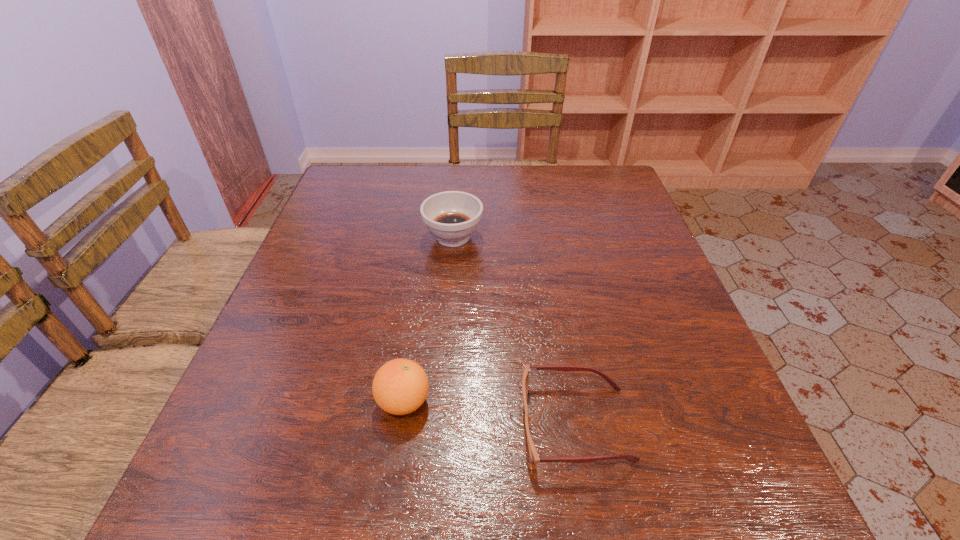
Find the location of `unoccupied position between the rightmost object and the orange`. unoccupied position between the rightmost object and the orange is located at coordinates (490, 413).

This screenshot has width=960, height=540. I want to click on unoccupied position between the orange and the spectacles, so click(490, 413).

Image resolution: width=960 pixels, height=540 pixels. In order to click on unoccupied area between the orange and the rightmost object in this screenshot , I will do `click(490, 413)`.

Identify the location of free space between the orange and the rightmost object. Image resolution: width=960 pixels, height=540 pixels. (490, 413).

Identify the location of free space that is in between the orange and the soup bowl. The width and height of the screenshot is (960, 540). (428, 319).

Where is `empty location between the soup bowl and the rightmost object`? This screenshot has width=960, height=540. empty location between the soup bowl and the rightmost object is located at coordinates (515, 330).

In order to click on free area in between the soup bowl and the orange in this screenshot , I will do `click(428, 319)`.

Where is `unoccupied position between the orange and the shortest object`? This screenshot has height=540, width=960. unoccupied position between the orange and the shortest object is located at coordinates (490, 413).

The height and width of the screenshot is (540, 960). In order to click on object that stands as the second closest to the shortest object in this screenshot , I will do `click(452, 216)`.

Identify which object is located as the nearest to the rightmost object. Please provide its 2D coordinates. Your answer should be formatted as a tuple, i.e. [(x, y)], where the tuple contains the x and y coordinates of a point satisfying the conditions above.

[(400, 386)]